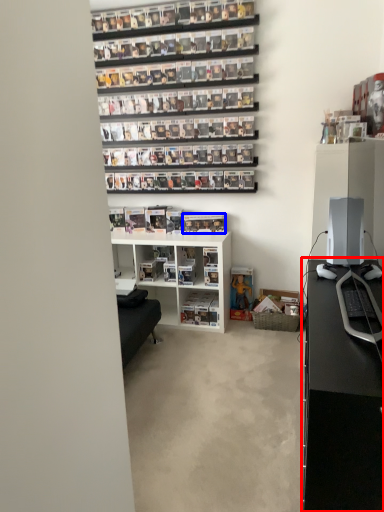
Question: Which point is closer to the camera, desk (highlighted by a red box) or book (highlighted by a blue box)?

Choices:
 (A) desk
 (B) book

Answer: (A)